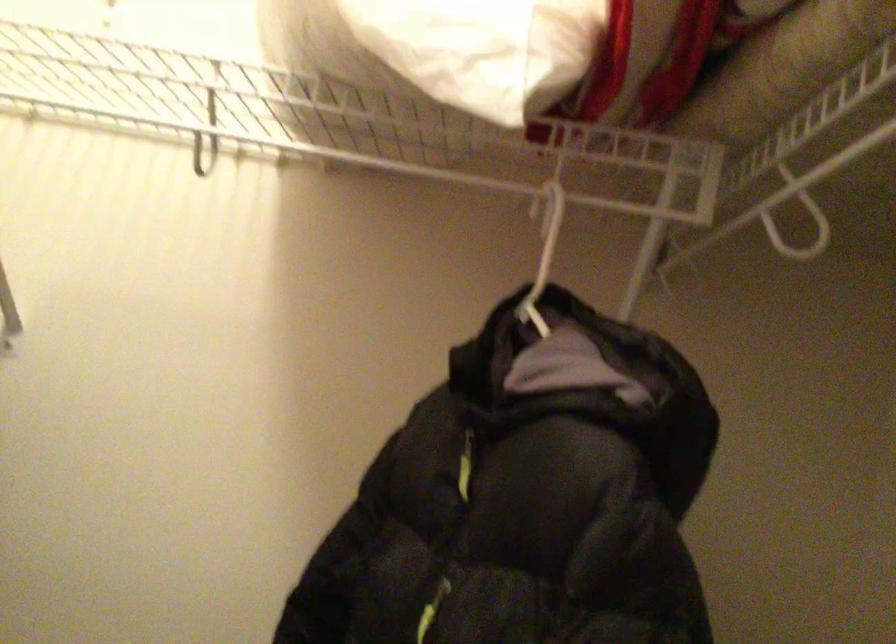
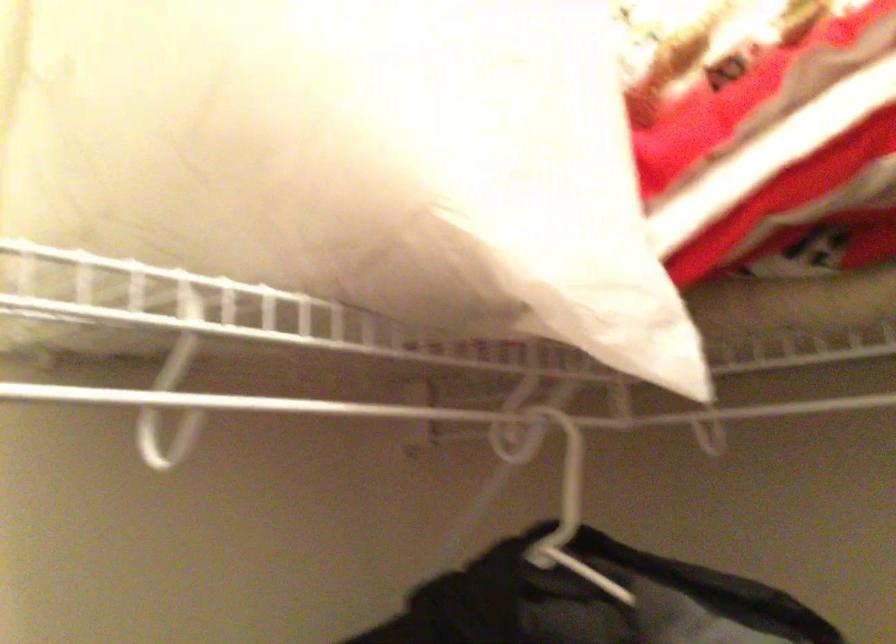
Question: Based on the continuous images, in which direction is the camera rotating? Reply with the corresponding letter.

Choices:
 (A) Left
 (B) Right
 (C) Up
 (D) Down

Answer: (B)